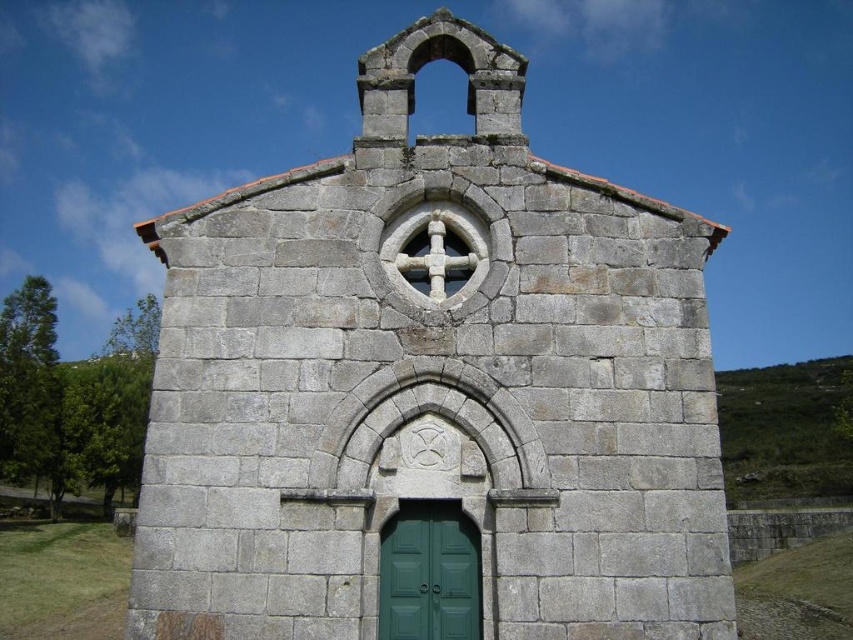
Between gray stone church at center and green wooden door at center, which one appears on the right side from the viewer's perspective?

Positioned to the right is green wooden door at center.

The image size is (853, 640). Find the location of `gray stone church at center`. gray stone church at center is located at coordinates (432, 388).

Identify the location of gray stone church at center. (432, 388).

Locate an element on the screen. This screenshot has width=853, height=640. gray stone church at center is located at coordinates (432, 388).

How distant is green wooden door at center from white stone cross at center?

green wooden door at center is 22.15 feet away from white stone cross at center.

Does green wooden door at center have a lesser height compared to white stone cross at center?

Indeed, green wooden door at center has a lesser height compared to white stone cross at center.

Locate an element on the screen. This screenshot has width=853, height=640. green wooden door at center is located at coordinates (428, 573).

The width and height of the screenshot is (853, 640). What do you see at coordinates (432, 388) in the screenshot?
I see `gray stone church at center` at bounding box center [432, 388].

Between point (299, 609) and point (416, 259), which one is positioned in front?

Point (299, 609)

Between point (367, 492) and point (415, 237), which one is positioned behind?

The point (415, 237) is more distant.

The image size is (853, 640). I want to click on gray stone church at center, so click(x=432, y=388).